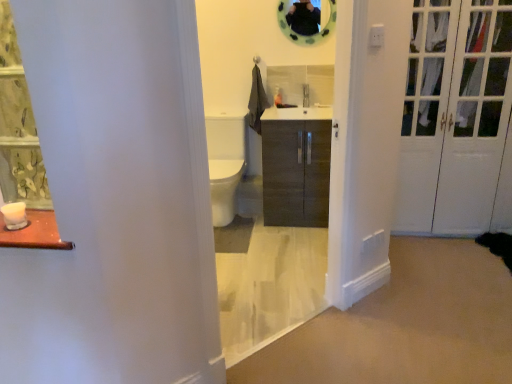
Question: Considering the positions of green floral fabric curtain at left and matte wood cabinet at center in the image, is green floral fabric curtain at left wider or thinner than matte wood cabinet at center?

Choices:
 (A) thin
 (B) wide

Answer: (A)

Question: From a real-world perspective, is green floral fabric curtain at left physically located above or below matte wood cabinet at center?

Choices:
 (A) above
 (B) below

Answer: (A)

Question: Which object is positioned farthest from the green rubber mirror at upper center?

Choices:
 (A) dark wood cabinet at center
 (B) matte wood cabinet at center
 (C) white glossy door at right
 (D) green floral fabric curtain at left

Answer: (D)

Question: Which object is positioned farthest from the dark wood cabinet at center?

Choices:
 (A) white glossy door at right
 (B) matte wood cabinet at center
 (C) green floral fabric curtain at left
 (D) green rubber mirror at upper center

Answer: (C)